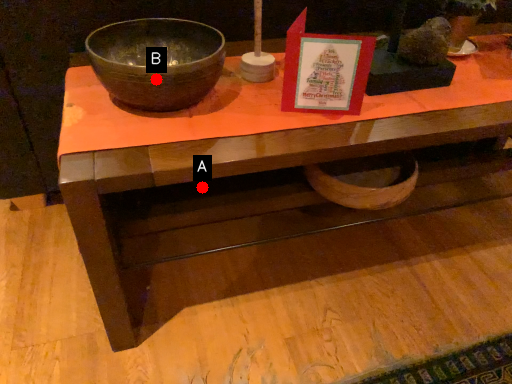
Question: Two points are circled on the image, labeled by A and B beside each circle. Which point appears farthest from the camera in this image?

Choices:
 (A) A is further
 (B) B is further

Answer: (A)